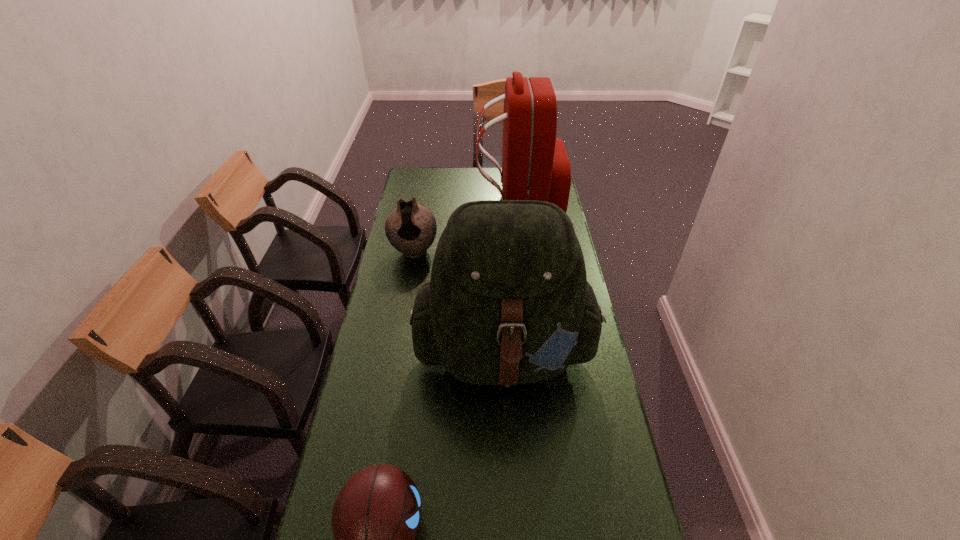
At what (x,y) coordinates should I click in order to perform the action: click on vacant space that satisfies the following two spatial constraints: 1. on the strap side of the farther backpack; 2. on the open flap of the nearer backpack. Please return your answer as a coordinate pair (x, y). This screenshot has height=540, width=960. Looking at the image, I should click on (536, 351).